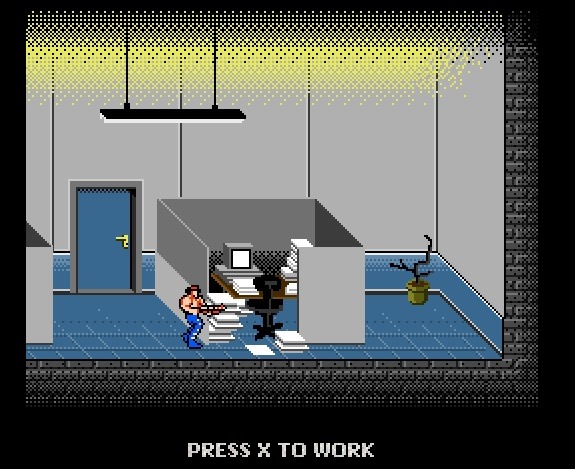
Where is `stacks of paper`? The width and height of the screenshot is (575, 469). stacks of paper is located at coordinates (218, 331), (224, 313), (221, 300), (295, 249), (290, 269), (286, 341), (240, 287).